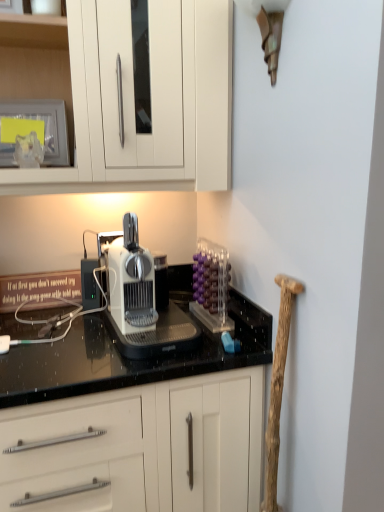
Question: From a real-world perspective, is white plastic coffee machine at center beneath wooden at right?

Choices:
 (A) no
 (B) yes

Answer: (A)

Question: Considering the relative positions of white plastic coffee machine at center and wooden at right in the image provided, is white plastic coffee machine at center to the right of wooden at right from the viewer's perspective?

Choices:
 (A) yes
 (B) no

Answer: (B)

Question: From the image's perspective, does white plastic coffee machine at center appear higher than wooden at right?

Choices:
 (A) no
 (B) yes

Answer: (B)

Question: Considering the relative sizes of white plastic coffee machine at center and wooden at right in the image provided, is white plastic coffee machine at center thinner than wooden at right?

Choices:
 (A) yes
 (B) no

Answer: (B)

Question: Does white plastic coffee machine at center have a lesser height compared to wooden at right?

Choices:
 (A) no
 (B) yes

Answer: (B)

Question: From a real-world perspective, relative to matte glass frame at upper left, is transparent acrylic container at upper right vertically above or below?

Choices:
 (A) above
 (B) below

Answer: (B)

Question: Would you say transparent acrylic container at upper right is inside or outside matte glass frame at upper left?

Choices:
 (A) outside
 (B) inside

Answer: (A)

Question: Would you say transparent acrylic container at upper right is to the left or to the right of matte glass frame at upper left in the picture?

Choices:
 (A) right
 (B) left

Answer: (A)

Question: Is transparent acrylic container at upper right in front of or behind matte glass frame at upper left in the image?

Choices:
 (A) front
 (B) behind

Answer: (A)

Question: Considering the positions of black granite countertop at center and white plastic coffee machine at center in the image, is black granite countertop at center bigger or smaller than white plastic coffee machine at center?

Choices:
 (A) small
 (B) big

Answer: (B)

Question: In terms of height, does black granite countertop at center look taller or shorter compared to white plastic coffee machine at center?

Choices:
 (A) short
 (B) tall

Answer: (B)

Question: Do you think black granite countertop at center is within white plastic coffee machine at center, or outside of it?

Choices:
 (A) inside
 (B) outside

Answer: (B)

Question: Is black granite countertop at center wider or thinner than white plastic coffee machine at center?

Choices:
 (A) wide
 (B) thin

Answer: (A)

Question: Based on their sizes in the image, would you say transparent acrylic container at upper right is bigger or smaller than black granite countertop at center?

Choices:
 (A) small
 (B) big

Answer: (A)

Question: Is point (210, 246) positioned closer to the camera than point (26, 403)?

Choices:
 (A) farther
 (B) closer

Answer: (A)